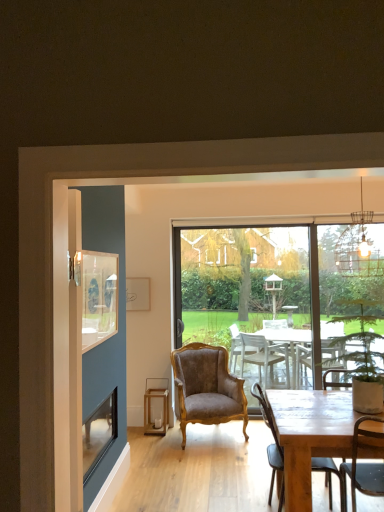
Question: Based on their positions, is wooden lantern at lower center located to the left or right of wooden chair at lower right, acting as the second chair starting from the left?

Choices:
 (A) left
 (B) right

Answer: (A)

Question: In terms of width, does wooden lantern at lower center look wider or thinner when compared to wooden chair at lower right, acting as the second chair starting from the left?

Choices:
 (A) thin
 (B) wide

Answer: (A)

Question: Which object is the closest to the wooden chair at lower right, which is the first chair from right to left?

Choices:
 (A) clear glass window screen at left
 (B) green leafy plant in pot at right
 (C) velvet brown armchair at center, arranged as the second chair when viewed from the front
 (D) metallic wire cage at upper right
 (E) wooden lantern at lower center

Answer: (B)

Question: Estimate the real-world distances between objects in this image. Which object is farther from the velvet brown armchair at center?

Choices:
 (A) green leafy plant in pot at right
 (B) transparent glass window at center
 (C) wooden lantern at lower center
 (D) metallic wire cage at upper right
 (E) clear glass window screen at left

Answer: (D)